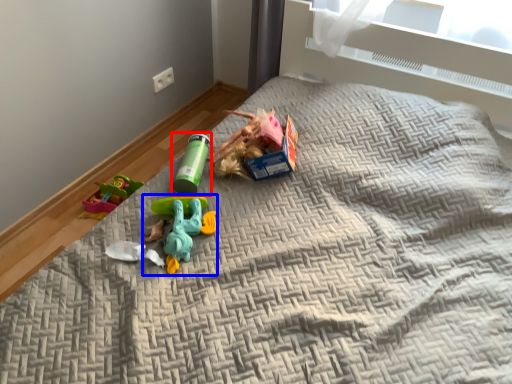
Question: Among these objects, which one is nearest to the camera, toy (highlighted by a red box) or toy (highlighted by a blue box)?

Choices:
 (A) toy
 (B) toy

Answer: (B)